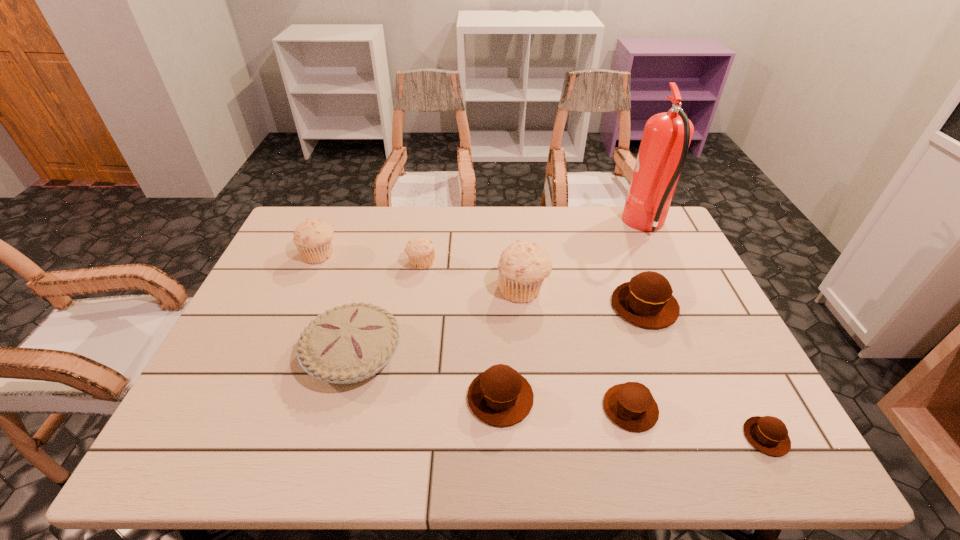
This screenshot has height=540, width=960. I want to click on free space located 0.140m on the back of the farthest brown muffin, so click(624, 254).

Image resolution: width=960 pixels, height=540 pixels. Find the location of `vacant space located on the left of the sixth muffin from right to left`. vacant space located on the left of the sixth muffin from right to left is located at coordinates (322, 263).

I want to click on vacant space located on the front of the pie, so click(x=327, y=451).

The width and height of the screenshot is (960, 540). I want to click on vacant space located 0.270m on the left of the second biggest brown muffin, so click(348, 398).

Image resolution: width=960 pixels, height=540 pixels. In order to click on free spot located on the right of the sixth tallest muffin in this screenshot , I will do `click(725, 408)`.

Image resolution: width=960 pixels, height=540 pixels. I want to click on blank space located 0.300m on the left of the rightmost brown muffin, so click(x=602, y=437).

This screenshot has height=540, width=960. I want to click on fire extinguisher at the far edge, so click(666, 138).

Where is `muffin present at the far edge`? Image resolution: width=960 pixels, height=540 pixels. muffin present at the far edge is located at coordinates (313, 238).

Identify the location of object that is at the left edge. The width and height of the screenshot is (960, 540). (313, 238).

Where is `fire extinguisher that is at the right edge`? This screenshot has height=540, width=960. fire extinguisher that is at the right edge is located at coordinates (666, 138).